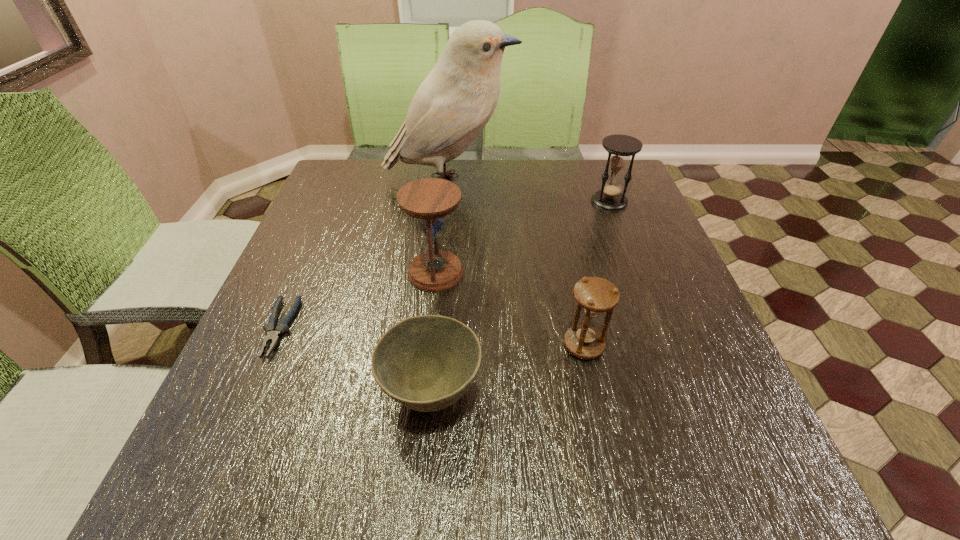
The width and height of the screenshot is (960, 540). Identify the location of free space that satisfies the following two spatial constraints: 1. on the face of the parakeet; 2. on the right side of the rightmost object. (447, 201).

You are a GUI agent. You are given a task and a screenshot of the screen. Output one action in this format:
    pyautogui.click(x=<x>, y=<y>)
    Task: Click on the vacant space that satisfies the following two spatial constraints: 1. on the face of the tallest object; 2. at the gripping part of the leftmost object
    
    Given the screenshot: What is the action you would take?
    pyautogui.click(x=435, y=328)